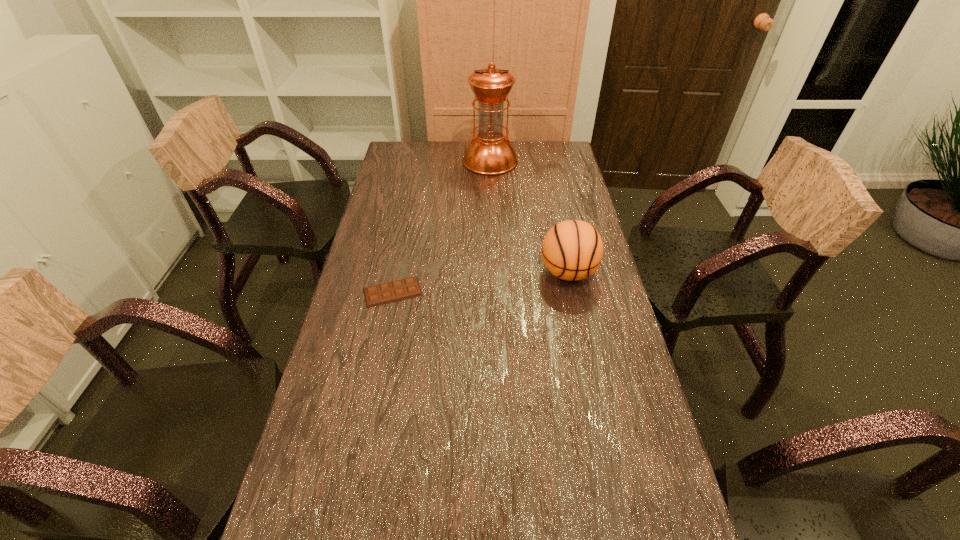
Find the location of a particular element. unoccupied area between the shortest object and the rightmost object is located at coordinates (480, 282).

You are a GUI agent. You are given a task and a screenshot of the screen. Output one action in this format:
    pyautogui.click(x=<x>, y=<y>)
    Task: Click on the free space between the second shortest object and the chocolate bar
    The width and height of the screenshot is (960, 540).
    Given the screenshot: What is the action you would take?
    [x=480, y=282]

At what (x,y) coordinates should I click in order to perform the action: click on object that ranks as the closest to the shortest object. Please return your answer as a coordinate pair (x, y). This screenshot has width=960, height=540. Looking at the image, I should click on (572, 250).

Identify which object is located as the second nearest to the tallest object. Please provide its 2D coordinates. Your answer should be formatted as a tuple, i.e. [(x, y)], where the tuple contains the x and y coordinates of a point satisfying the conditions above.

[(380, 294)]